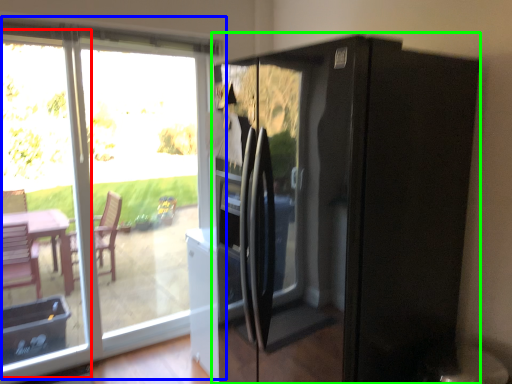
Question: Which object is positioned farthest from glass door (highlighted by a red box)? Select from window (highlighted by a blue box) and appliance (highlighted by a green box).

Choices:
 (A) window
 (B) appliance

Answer: (B)